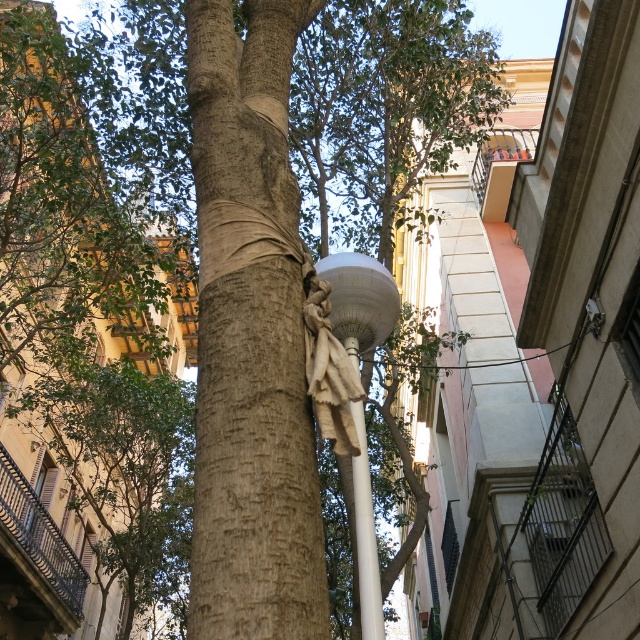
Who is higher up, light brown bark tree trunk at center or white matte lamp post at center?

light brown bark tree trunk at center is higher up.

Is light brown bark tree trunk at center to the left of white matte lamp post at center from the viewer's perspective?

Correct, you'll find light brown bark tree trunk at center to the left of white matte lamp post at center.

You are a GUI agent. You are given a task and a screenshot of the screen. Output one action in this format:
    pyautogui.click(x=<x>, y=<y>)
    Task: Click on the light brown bark tree trunk at center
    The height and width of the screenshot is (640, 640).
    Given the screenshot: What is the action you would take?
    pyautogui.click(x=250, y=337)

Which is more to the left, white matte lamp post at center or white glossy pole at center?

white matte lamp post at center

Measure the distance between point (330,259) and camera.

Point (330,259) and camera are 18.17 meters apart.

The width and height of the screenshot is (640, 640). Find the location of `white matte lamp post at center`. white matte lamp post at center is located at coordinates tap(358, 300).

Is light brown bark tree trunk at center taller than white stone statue at center?

Yes, light brown bark tree trunk at center is taller than white stone statue at center.

Measure the distance between light brown bark tree trunk at center and white stone statue at center.

2.33 meters

Is point (300, 490) positioned behind point (316, 355)?

No, it is not.

You are a GUI agent. You are given a task and a screenshot of the screen. Output one action in this format:
    pyautogui.click(x=<x>, y=<y>)
    Task: Click on the light brown bark tree trunk at center
    
    Given the screenshot: What is the action you would take?
    pyautogui.click(x=250, y=337)